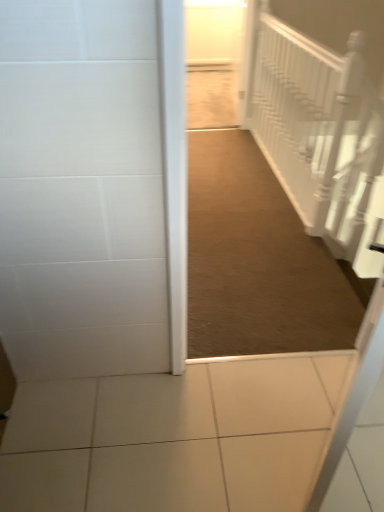
This screenshot has height=512, width=384. Identify the location of vacant space underneath white textured stairwell at upper right (from a real-world perspective). (276, 178).